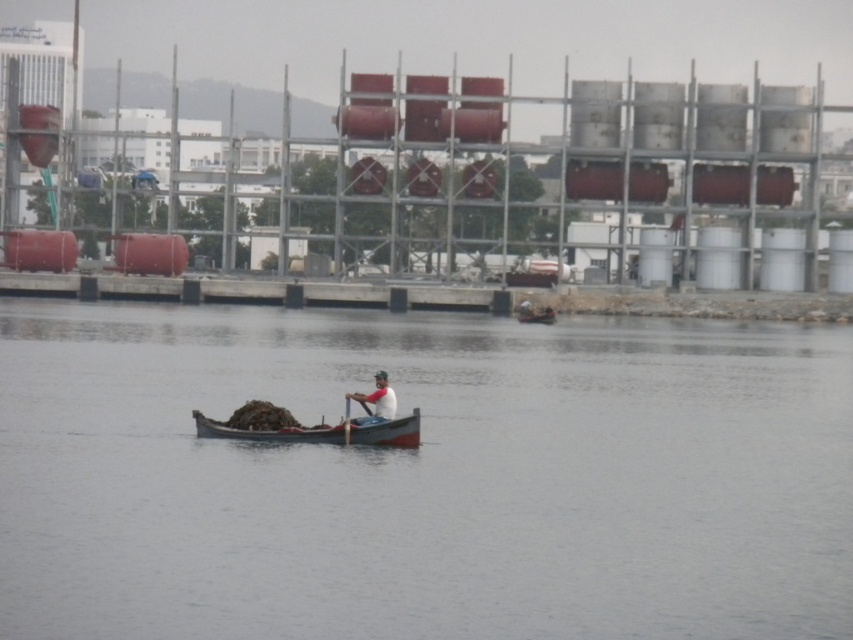
You are a photographer trying to capture the waterfront scene. You want to ensure both the white matte shirt at center and the wooden canoe at center are clearly visible in your shot. Given their sizes, which object should you focus on to ensure both are in frame without cropping?

Since the white matte shirt at center is smaller than the wooden canoe at center, you should focus on the wooden canoe at center as it takes up more space, ensuring both objects remain in frame without cropping.

You are standing on the dock and want to check if the wooden boat at center can fit into a storage area that can hold objects up to the size of the clear water at center. Can it fit?

The clear water at center has a larger size compared to wooden boat at center, so the wooden boat at center can fit into the storage area.